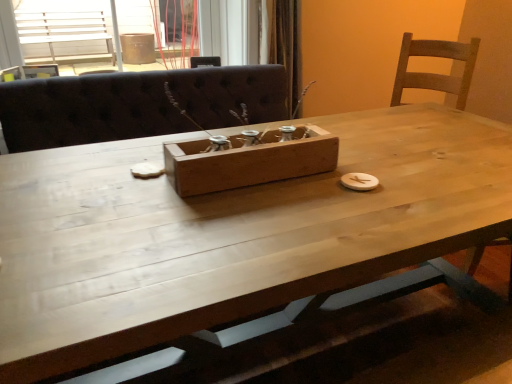
Question: Is wooden box at center facing towards wooden frame at upper center?

Choices:
 (A) yes
 (B) no

Answer: (B)

Question: Would you say wooden box at center contains wooden frame at upper center?

Choices:
 (A) no
 (B) yes

Answer: (A)

Question: Considering the relative sizes of wooden box at center and wooden frame at upper center in the image provided, is wooden box at center taller than wooden frame at upper center?

Choices:
 (A) yes
 (B) no

Answer: (B)

Question: Considering the relative sizes of wooden box at center and wooden frame at upper center in the image provided, is wooden box at center smaller than wooden frame at upper center?

Choices:
 (A) no
 (B) yes

Answer: (B)

Question: Considering the relative sizes of wooden box at center and wooden frame at upper center in the image provided, is wooden box at center thinner than wooden frame at upper center?

Choices:
 (A) yes
 (B) no

Answer: (A)

Question: Looking at their shapes, would you say wooden frame at upper center is wider or thinner than natural wood table at center?

Choices:
 (A) wide
 (B) thin

Answer: (A)

Question: In terms of size, does wooden frame at upper center appear bigger or smaller than natural wood table at center?

Choices:
 (A) small
 (B) big

Answer: (A)

Question: From the image's perspective, is wooden frame at upper center positioned above or below natural wood table at center?

Choices:
 (A) below
 (B) above

Answer: (B)

Question: In the image, is wooden frame at upper center positioned in front of or behind natural wood table at center?

Choices:
 (A) behind
 (B) front

Answer: (A)

Question: Considering the positions of point (61, 334) and point (121, 0), is point (61, 334) closer or farther from the camera than point (121, 0)?

Choices:
 (A) farther
 (B) closer

Answer: (B)

Question: Is natural wood table at center spatially inside wooden frame at upper center, or outside of it?

Choices:
 (A) outside
 (B) inside

Answer: (A)

Question: Considering their positions, is natural wood table at center located in front of or behind wooden frame at upper center?

Choices:
 (A) front
 (B) behind

Answer: (A)

Question: Is natural wood table at center wider or thinner than wooden frame at upper center?

Choices:
 (A) thin
 (B) wide

Answer: (A)

Question: From the image's perspective, is wooden box at center positioned above or below wooden frame at upper center?

Choices:
 (A) below
 (B) above

Answer: (A)

Question: Is wooden box at center bigger or smaller than wooden frame at upper center?

Choices:
 (A) small
 (B) big

Answer: (A)